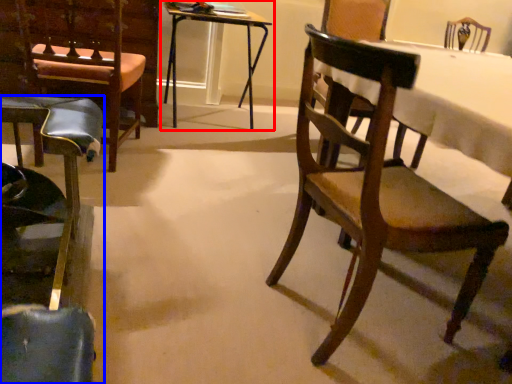
Question: Which point is further to the camera, table (highlighted by a red box) or chair (highlighted by a blue box)?

Choices:
 (A) table
 (B) chair

Answer: (A)